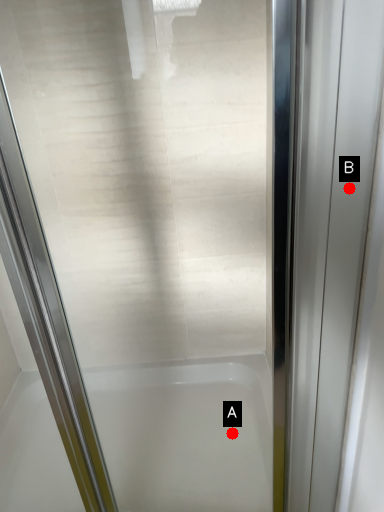
Question: Two points are circled on the image, labeled by A and B beside each circle. Which of the following is the farthest from the observer?

Choices:
 (A) A is further
 (B) B is further

Answer: (A)